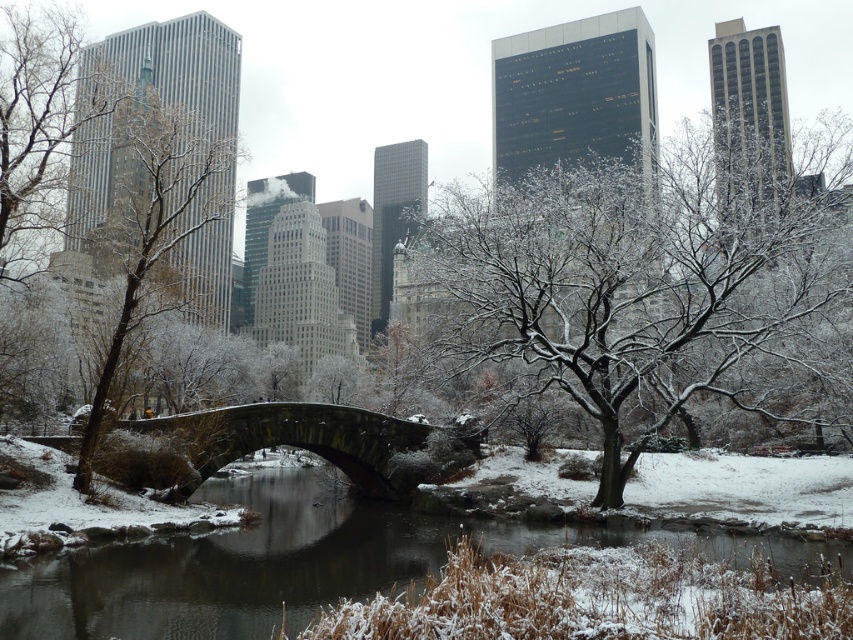
You are standing in the winter scene at Central Park and want to reach the point marked as point (177,189). If your walking speed is 3 feet per second, how many seconds will it take you to reach that point?

The point (177,189) is 289.13 feet away from the viewer. At a walking speed of 3 feet per second, it would take approximately 289.13 divided by 3, which equals about 96.38 seconds to reach the point.

You are an architect analyzing the winter scene in Central Park. You observe the snowy concrete bridge at center and the dark gray stone bridge at center. Which bridge would require more snow removal efforts due to its size?

The snowy concrete bridge at center requires more snow removal efforts because it is larger in size than the dark gray stone bridge at center.

You are standing in the winter scene and want to cross the water. You see the snowy concrete bridge at center and the dark gray stone bridge at center. Which bridge is closer to you?

The snowy concrete bridge at center is closer because it is in front of the dark gray stone bridge at center.